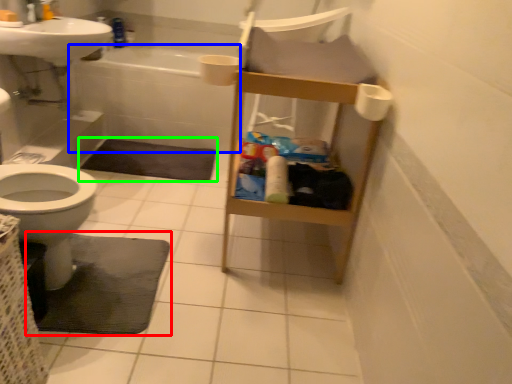
Question: Which is nearer to the bath mat (highlighted by a red box)? bath (highlighted by a blue box) or bath mat (highlighted by a green box).

Choices:
 (A) bath
 (B) bath mat

Answer: (B)